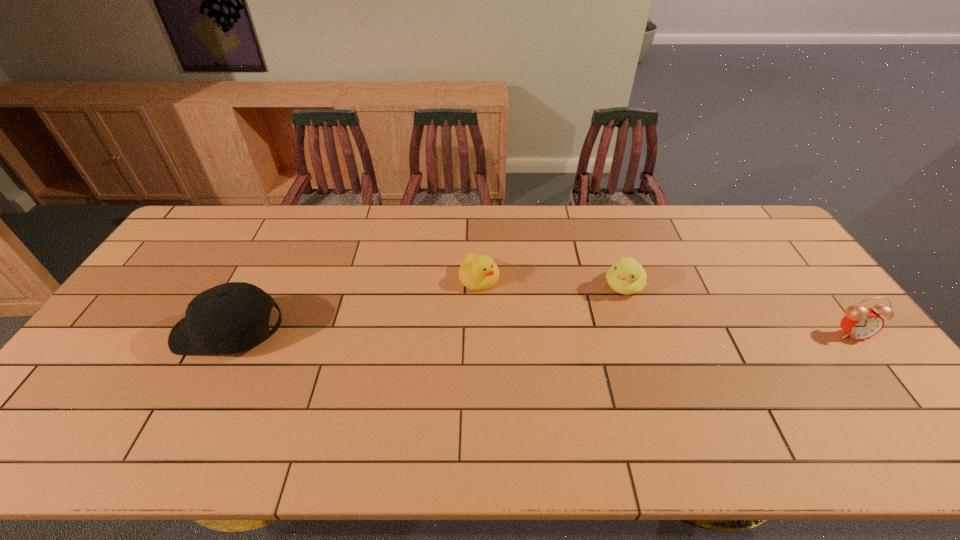
The width and height of the screenshot is (960, 540). Find the location of `object that is the closest to the right duckling`. object that is the closest to the right duckling is located at coordinates (477, 272).

Find the location of a particular element. object that is the second closest to the rightmost object is located at coordinates (477, 272).

This screenshot has height=540, width=960. I want to click on vacant space that satisfies the following two spatial constraints: 1. on the front side of the left duckling; 2. on the left side of the third object from left to right, so click(479, 286).